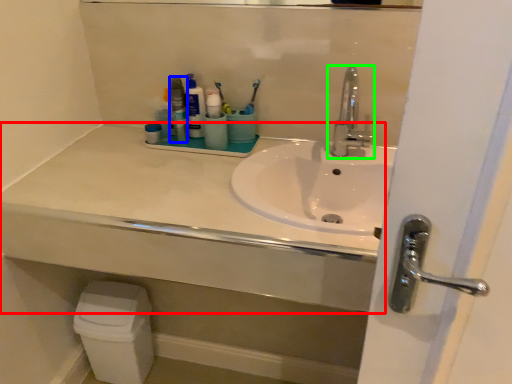
Question: Based on their relative distances, which object is farther from counter top (highlighted by a red box)? Choose from mouthwash (highlighted by a blue box) and tap (highlighted by a green box).

Choices:
 (A) mouthwash
 (B) tap

Answer: (B)